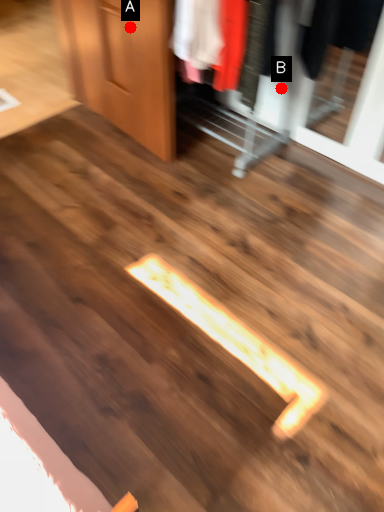
Question: Two points are circled on the image, labeled by A and B beside each circle. Which point is closer to the camera?

Choices:
 (A) A is closer
 (B) B is closer

Answer: (A)